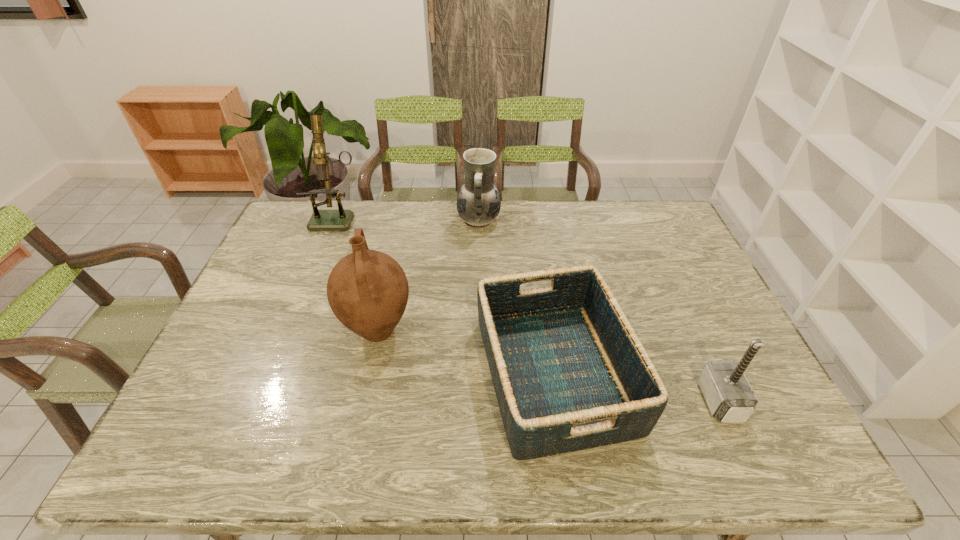
This screenshot has height=540, width=960. I want to click on free region located on the front-facing side of the right pitcher, so click(x=516, y=221).

Locate an element on the screen. free spot located for striking with the head of the hammer is located at coordinates (625, 401).

In order to click on free space located 0.190m for striking with the head of the hammer in this screenshot , I will do `click(625, 401)`.

Find the location of `free space located 0.080m for striking with the head of the hammer`. free space located 0.080m for striking with the head of the hammer is located at coordinates (670, 401).

Where is `free space located 0.060m on the right of the basket`? This screenshot has width=960, height=540. free space located 0.060m on the right of the basket is located at coordinates (656, 373).

I want to click on microscope that is at the far edge, so click(x=341, y=219).

Locate an element on the screen. The height and width of the screenshot is (540, 960). pitcher positioned at the far edge is located at coordinates (478, 203).

Locate an element on the screen. object at the near edge is located at coordinates (569, 372).

The width and height of the screenshot is (960, 540). Find the location of `object that is at the left edge`. object that is at the left edge is located at coordinates (341, 219).

What are the coordinates of `object at the right edge` in the screenshot? It's located at (729, 396).